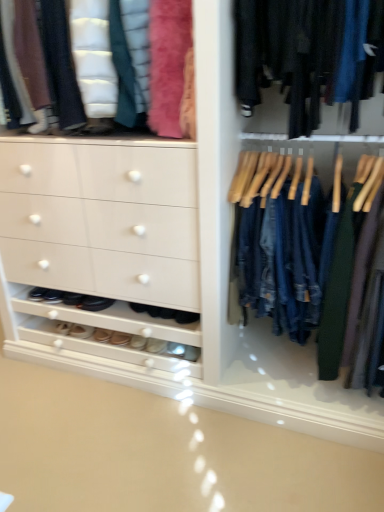
Question: From the image's perspective, is white leather shoe at lower center, acting as the 4th footwear starting from the left, located beneath leather shoes at lower center, arranged as the second footwear when viewed from the right?

Choices:
 (A) yes
 (B) no

Answer: (B)

Question: Can you confirm if white leather shoe at lower center, acting as the 3th footwear starting from the right, is shorter than leather shoes at lower center, which is the fifth footwear from left to right?

Choices:
 (A) yes
 (B) no

Answer: (B)

Question: Are white leather shoe at lower center, acting as the 3th footwear starting from the right, and leather shoes at lower center, arranged as the second footwear when viewed from the right, making contact?

Choices:
 (A) yes
 (B) no

Answer: (A)

Question: From a real-world perspective, is white leather shoe at lower center, acting as the 4th footwear starting from the left, over leather shoes at lower center, arranged as the second footwear when viewed from the right?

Choices:
 (A) yes
 (B) no

Answer: (B)

Question: Is white leather shoe at lower center, acting as the 4th footwear starting from the left, oriented towards leather shoes at lower center, arranged as the second footwear when viewed from the right?

Choices:
 (A) yes
 (B) no

Answer: (B)

Question: Is point (312, 174) closer or farther from the camera than point (160, 339)?

Choices:
 (A) farther
 (B) closer

Answer: (B)

Question: Based on their sizes in the image, would you say denim jeans at center is bigger or smaller than suede beige shoe at lower center, positioned as the 1th footwear in right-to-left order?

Choices:
 (A) big
 (B) small

Answer: (A)

Question: Considering the positions of denim jeans at center and suede beige shoe at lower center, which is counted as the sixth footwear, starting from the left, in the image, is denim jeans at center taller or shorter than suede beige shoe at lower center, which is counted as the sixth footwear, starting from the left,?

Choices:
 (A) short
 (B) tall

Answer: (B)

Question: In terms of width, does denim jeans at center look wider or thinner when compared to suede beige shoe at lower center, positioned as the 1th footwear in right-to-left order?

Choices:
 (A) thin
 (B) wide

Answer: (B)

Question: Considering the relative positions of leather shoes at lower center, arranged as the second footwear when viewed from the right, and black leather shoes at lower left, which ranks as the 2th footwear in left-to-right order, in the image provided, is leather shoes at lower center, arranged as the second footwear when viewed from the right, to the left or to the right of black leather shoes at lower left, which ranks as the 2th footwear in left-to-right order,?

Choices:
 (A) left
 (B) right

Answer: (B)

Question: Is leather shoes at lower center, which is the fifth footwear from left to right, in front of or behind black leather shoes at lower left, the 5th footwear positioned from the right, in the image?

Choices:
 (A) front
 (B) behind

Answer: (B)

Question: Considering the positions of leather shoes at lower center, which is the fifth footwear from left to right, and black leather shoes at lower left, which ranks as the 2th footwear in left-to-right order, in the image, is leather shoes at lower center, which is the fifth footwear from left to right, wider or thinner than black leather shoes at lower left, which ranks as the 2th footwear in left-to-right order,?

Choices:
 (A) wide
 (B) thin

Answer: (B)

Question: From the image's perspective, relative to black leather shoes at lower left, which ranks as the 2th footwear in left-to-right order, is leather shoes at lower center, arranged as the second footwear when viewed from the right, above or below?

Choices:
 (A) below
 (B) above

Answer: (A)

Question: Does point (331, 216) appear closer or farther from the camera than point (91, 327)?

Choices:
 (A) closer
 (B) farther

Answer: (A)

Question: Based on their sizes in the image, would you say denim jeans at center is bigger or smaller than white leather shoe at lower left, marked as the first footwear in a left-to-right arrangement?

Choices:
 (A) big
 (B) small

Answer: (A)